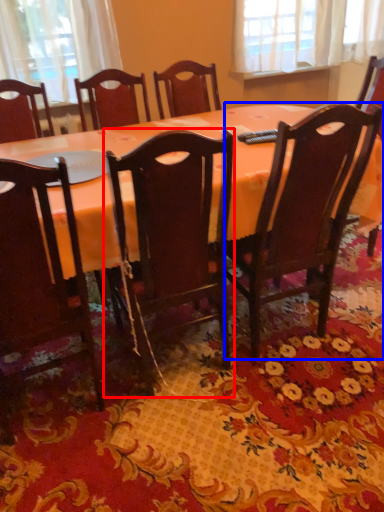
Question: Among these objects, which one is nearest to the camera, chair (highlighted by a red box) or chair (highlighted by a blue box)?

Choices:
 (A) chair
 (B) chair

Answer: (A)